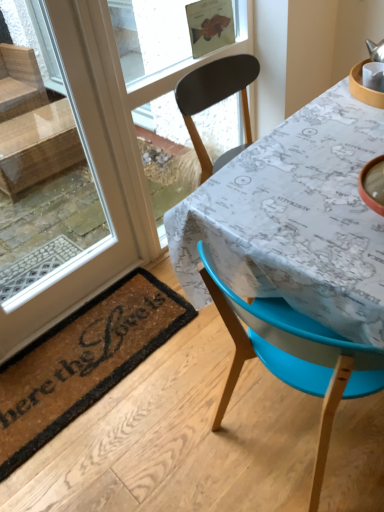
Where is `vacant region to the right of brown coir mat at lower left`? vacant region to the right of brown coir mat at lower left is located at coordinates (217, 395).